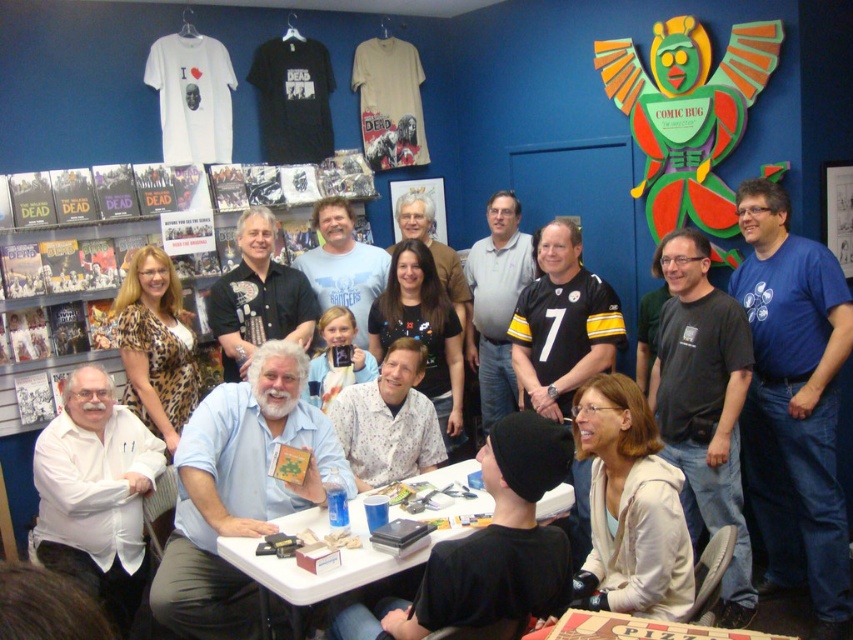
From the picture: Can you confirm if black matte shirt at center is positioned above wooden table at center?

Indeed, black matte shirt at center is positioned over wooden table at center.

Is black matte shirt at center thinner than wooden table at center?

Yes, black matte shirt at center is thinner than wooden table at center.

Is point (425, 314) less distant than point (566, 497)?

No, it is behind (566, 497).

This screenshot has width=853, height=640. Find the location of `black matte shirt at center`. black matte shirt at center is located at coordinates (422, 332).

Find the location of a particular element. The image size is (853, 640). white matte shirt at left is located at coordinates (96, 493).

Can you confirm if white matte shirt at left is bigger than white matte jacket at lower right?

Yes, white matte shirt at left is bigger than white matte jacket at lower right.

Does point (115, 547) come farther from viewer compared to point (585, 560)?

That is True.

Find the location of a particular element. The height and width of the screenshot is (640, 853). white matte shirt at left is located at coordinates (96, 493).

Who is positioned more to the right, blue cotton t-shirt at right or white matte shirt at left?

blue cotton t-shirt at right

Can you confirm if blue cotton t-shirt at right is positioned to the left of white matte shirt at left?

In fact, blue cotton t-shirt at right is to the right of white matte shirt at left.

Image resolution: width=853 pixels, height=640 pixels. Identify the location of blue cotton t-shirt at right. (793, 403).